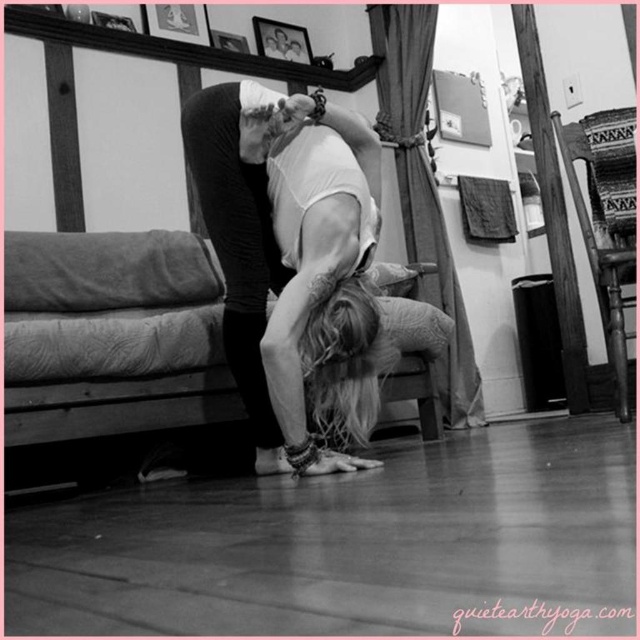
Can you confirm if white fabric at center is thinner than metallic silver picture frame at upper center?

Incorrect, white fabric at center's width is not less than metallic silver picture frame at upper center's.

Does white fabric at center have a larger size compared to metallic silver picture frame at upper center?

Yes, white fabric at center is bigger than metallic silver picture frame at upper center.

I want to click on white fabric at center, so click(x=292, y=262).

Between smooth blonde hair at lower center and metallic silver picture frame at upper center, which one is positioned higher?

metallic silver picture frame at upper center is higher up.

Can you confirm if smooth blonde hair at lower center is shorter than metallic silver picture frame at upper center?

In fact, smooth blonde hair at lower center may be taller than metallic silver picture frame at upper center.

Does point (420, 321) come behind point (176, 4)?

No, it is in front of (176, 4).

This screenshot has width=640, height=640. I want to click on smooth blonde hair at lower center, so click(x=358, y=356).

Does metallic silver picture frame at upper center come in front of wooden picture frame at upper center?

Yes.

Is point (168, 36) in front of point (300, 52)?

Yes, it is.

Identify the location of metallic silver picture frame at upper center. The width and height of the screenshot is (640, 640). (179, 20).